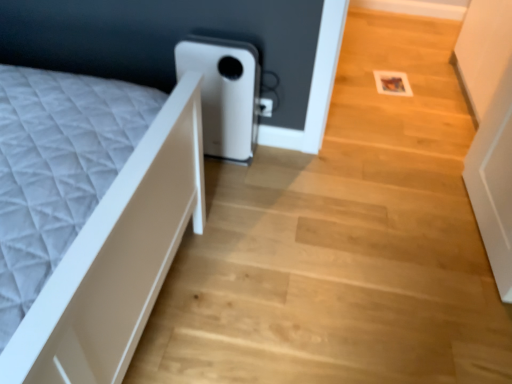
Question: Would you say wooden floor at center is inside or outside white matte water heater at center?

Choices:
 (A) outside
 (B) inside

Answer: (A)

Question: Does point (260, 319) appear closer or farther from the camera than point (206, 153)?

Choices:
 (A) farther
 (B) closer

Answer: (B)

Question: From the image's perspective, relative to white matte water heater at center, is wooden floor at center above or below?

Choices:
 (A) below
 (B) above

Answer: (A)

Question: Considering their positions, is white matte water heater at center located in front of or behind wooden floor at center?

Choices:
 (A) front
 (B) behind

Answer: (B)

Question: Choose the correct answer: Is white matte water heater at center inside wooden floor at center or outside it?

Choices:
 (A) inside
 (B) outside

Answer: (B)

Question: From a real-world perspective, is white matte water heater at center above or below wooden floor at center?

Choices:
 (A) below
 (B) above

Answer: (B)

Question: From the image's perspective, is white matte water heater at center above or below wooden floor at center?

Choices:
 (A) above
 (B) below

Answer: (A)